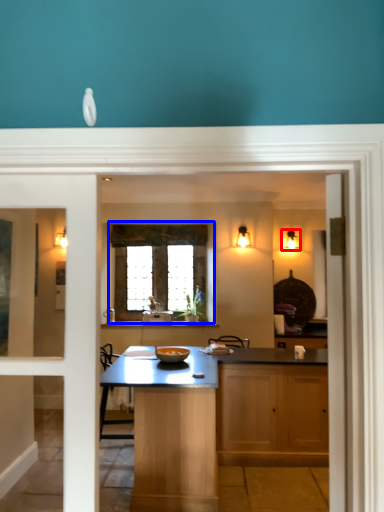
Question: Which object is further to the camera taking this photo, light fixture (highlighted by a red box) or window (highlighted by a blue box)?

Choices:
 (A) light fixture
 (B) window

Answer: (A)